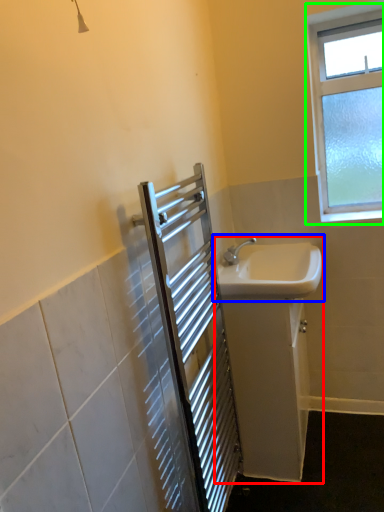
Question: Based on their relative distances, which object is nearer to sink (highlighted by a red box)? Choose from sink (highlighted by a blue box) and window (highlighted by a green box).

Choices:
 (A) sink
 (B) window

Answer: (A)